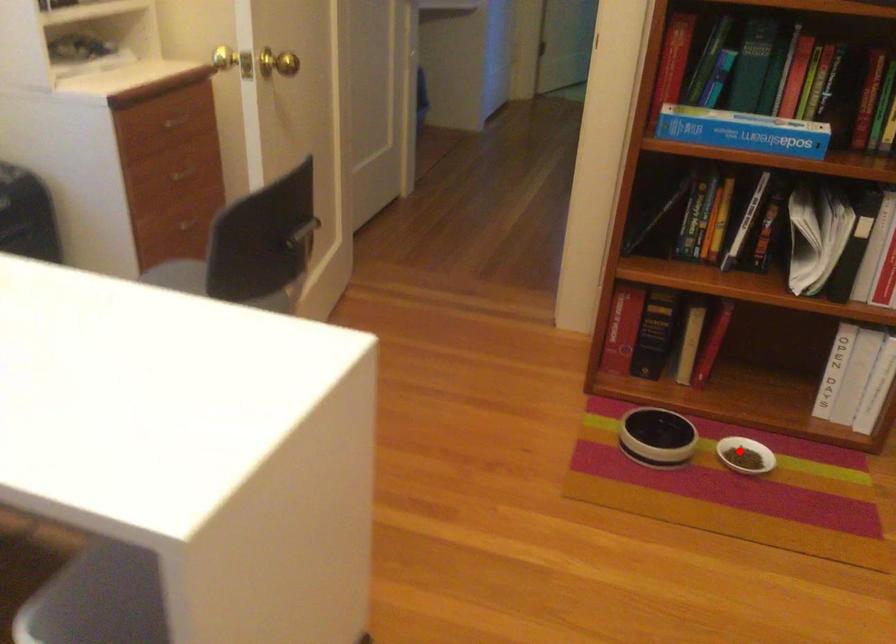
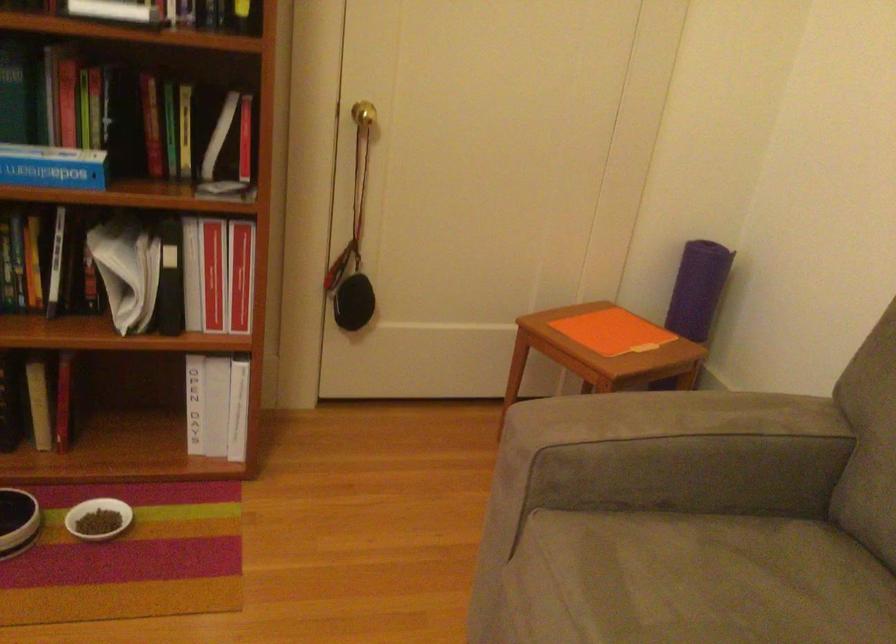
Question: I am providing you with two images of the same scene from different viewpoints. In image1, a red point is highlighted. Considering the same 3D point in image2, which of the following is correct?

Choices:
 (A) It is closer
 (B) It is farther

Answer: (A)